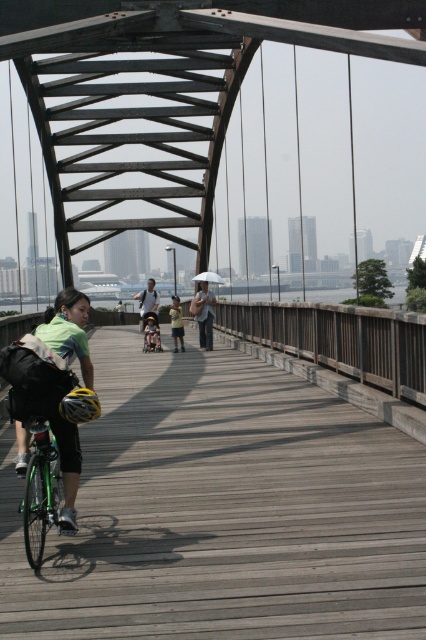
Who is shorter, wooden bridge at center or green matte bicycle at center?

wooden bridge at center is shorter.

Which is in front, point (371, 628) or point (144, 324)?

Positioned in front is point (371, 628).

This screenshot has width=426, height=640. I want to click on wooden bridge at center, so click(222, 509).

Does point (152, 278) come in front of point (155, 349)?

That is False.

Does light blue shirt at center appear over green matte bicycle at center?

Yes.

Who is more distant from viewer, (x=149, y=301) or (x=144, y=348)?

Point (x=149, y=301)

The image size is (426, 640). I want to click on light blue shirt at center, so click(147, 301).

Consider the image. Which is below, matte gray jacket at center or light blue shirt at center?

matte gray jacket at center

Is matte gray jacket at center below light blue shirt at center?

Yes.

Between point (210, 305) and point (155, 314), which one is positioned behind?

The point (155, 314) is behind.

At what (x,y) coordinates should I click in order to perform the action: click on matte gray jacket at center. Please return your answer as a coordinate pair (x, y). Image resolution: width=426 pixels, height=640 pixels. Looking at the image, I should click on (204, 314).